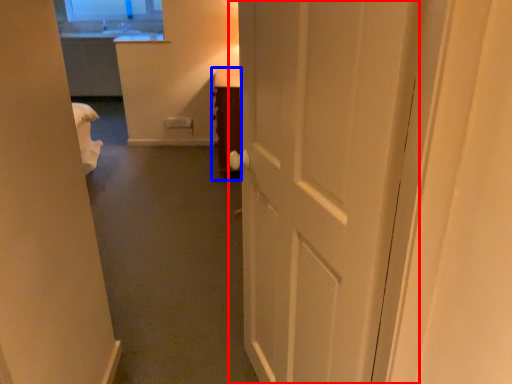
Question: Which object is further to the camera taking this photo, door (highlighted by a red box) or furniture (highlighted by a blue box)?

Choices:
 (A) door
 (B) furniture

Answer: (B)